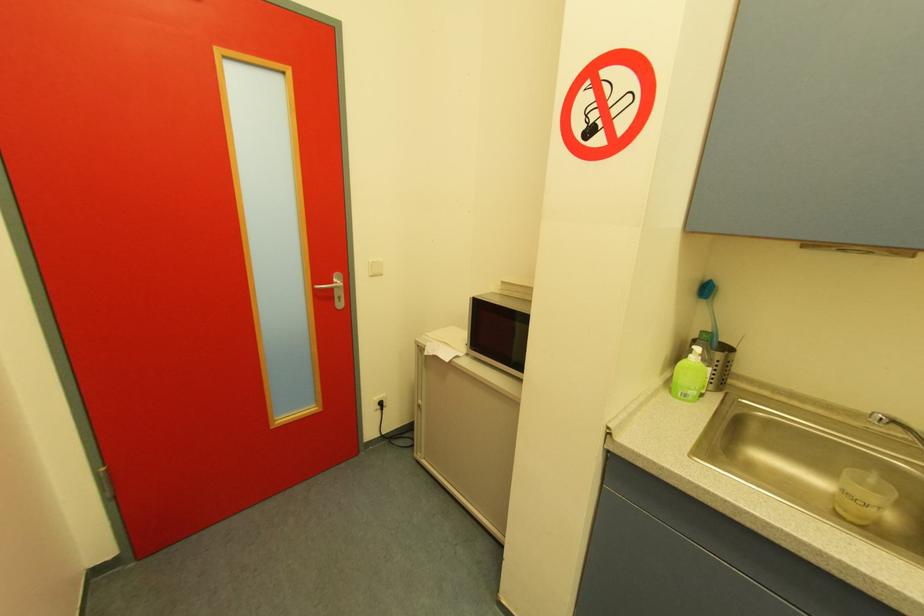
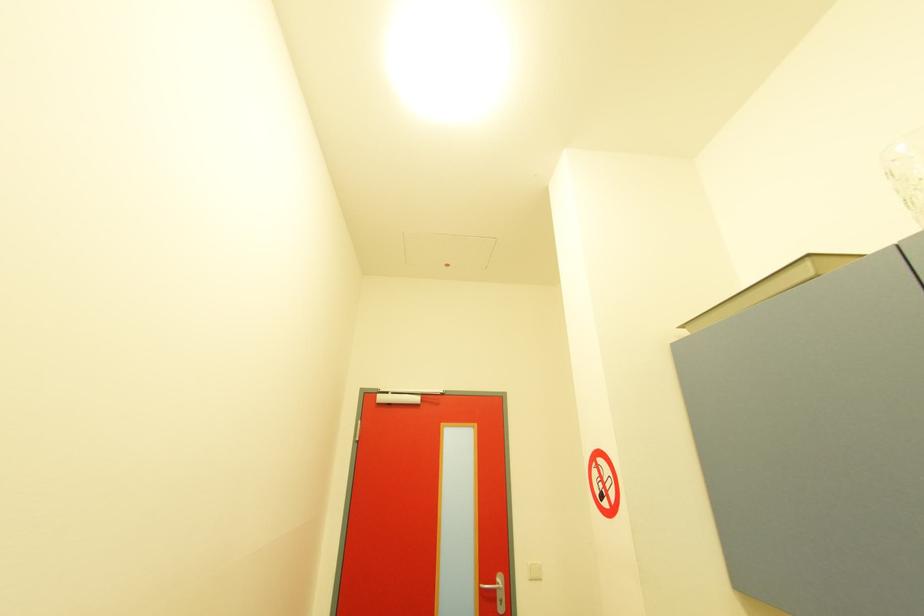
First-person continuous shooting, in which direction is the camera rotating?

The rotation direction of the camera is left-up.